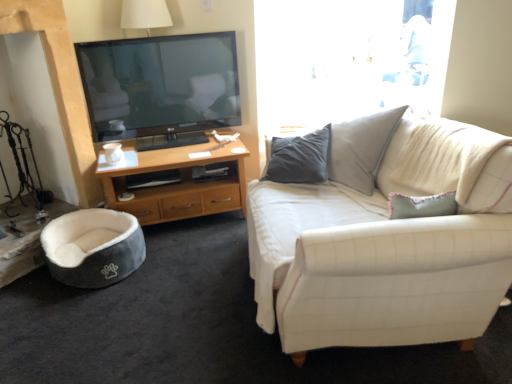
Question: Is white matte coffee cup at lower left looking in the opposite direction of white fabric couch at right?

Choices:
 (A) no
 (B) yes

Answer: (A)

Question: From a real-world perspective, is white matte coffee cup at lower left positioned under white fabric couch at right based on gravity?

Choices:
 (A) yes
 (B) no

Answer: (B)

Question: Can you confirm if white matte coffee cup at lower left is wider than white fabric couch at right?

Choices:
 (A) no
 (B) yes

Answer: (A)

Question: Is white matte coffee cup at lower left at the left side of white fabric couch at right?

Choices:
 (A) yes
 (B) no

Answer: (A)

Question: From the image's perspective, is white matte coffee cup at lower left over white fabric couch at right?

Choices:
 (A) yes
 (B) no

Answer: (A)

Question: From the image's perspective, is white matte coffee cup at lower left under white fabric couch at right?

Choices:
 (A) yes
 (B) no

Answer: (B)

Question: Are velvet grey bean bag at lower left and woodendesk at left far apart?

Choices:
 (A) yes
 (B) no

Answer: (B)

Question: Does velvet grey bean bag at lower left lie behind woodendesk at left?

Choices:
 (A) no
 (B) yes

Answer: (A)

Question: Is velvet grey bean bag at lower left wider than woodendesk at left?

Choices:
 (A) yes
 (B) no

Answer: (B)

Question: Is velvet grey bean bag at lower left positioned with its back to woodendesk at left?

Choices:
 (A) no
 (B) yes

Answer: (A)

Question: Can you confirm if velvet grey bean bag at lower left is shorter than woodendesk at left?

Choices:
 (A) yes
 (B) no

Answer: (A)

Question: Does velvet grey bean bag at lower left appear on the left side of woodendesk at left?

Choices:
 (A) yes
 (B) no

Answer: (A)

Question: Is white fabric couch at right facing away from woodendesk at left?

Choices:
 (A) no
 (B) yes

Answer: (A)